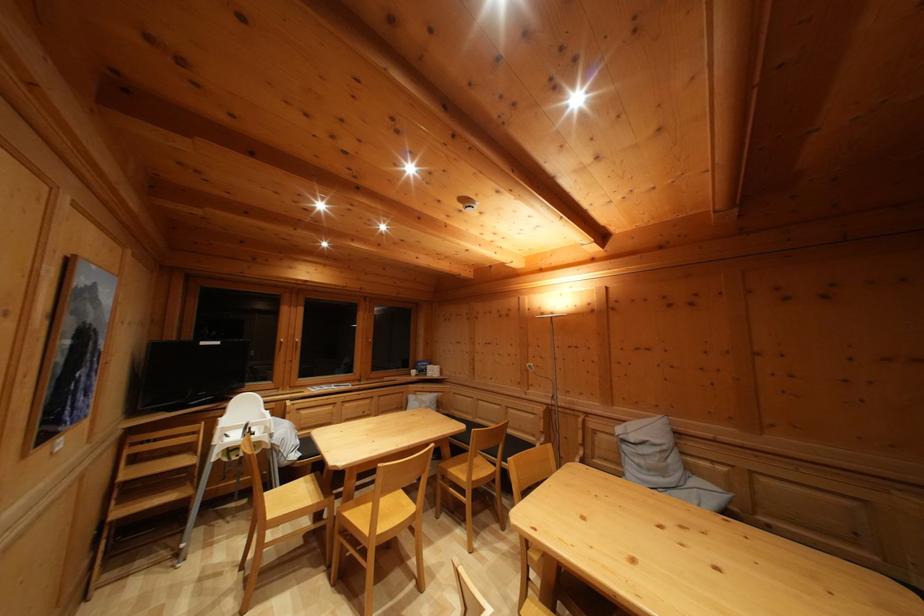
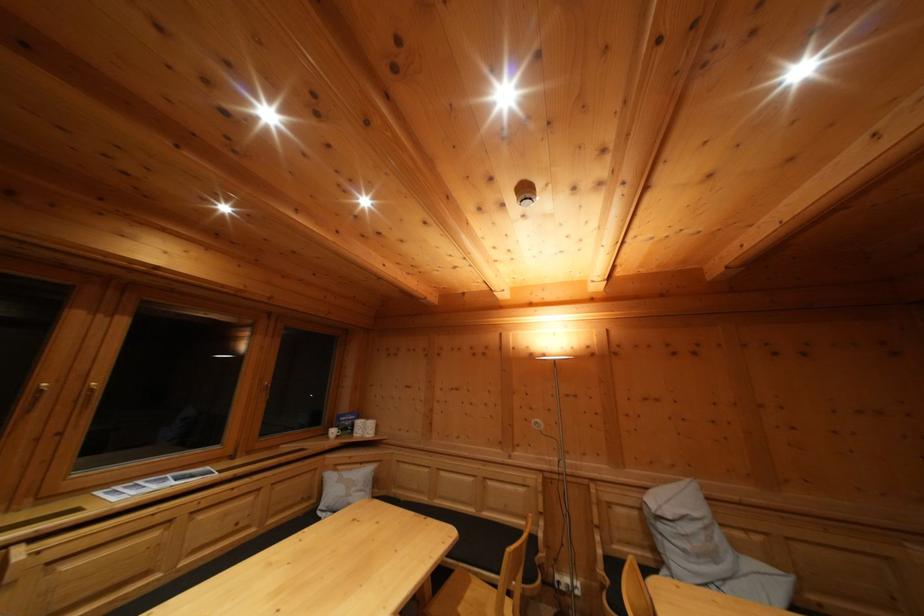
In the second image, find the point that corresponds to point (540, 442) in the first image.

(532, 525)